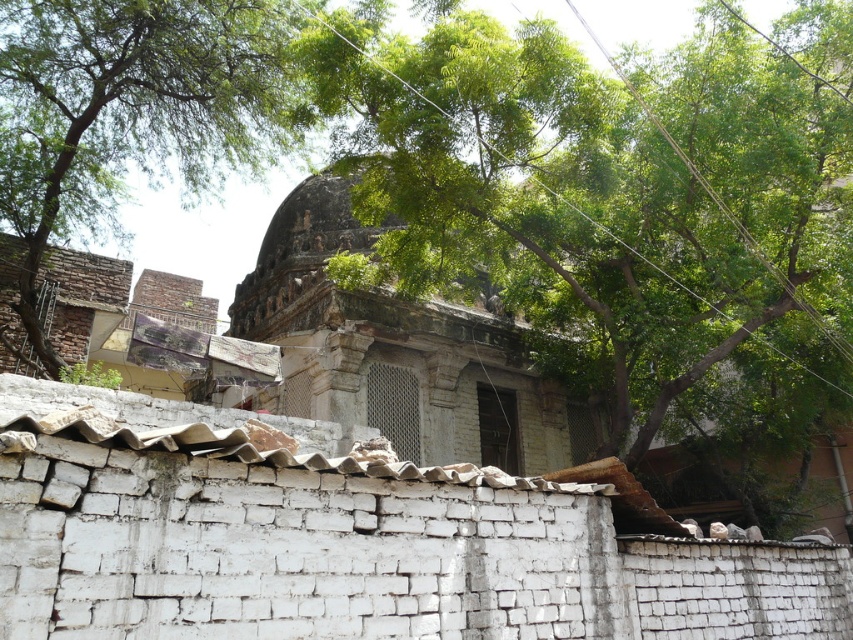
Question: Does green leafy tree at upper center have a lesser width compared to green leafy tree at upper left?

Choices:
 (A) no
 (B) yes

Answer: (A)

Question: Among these objects, which one is farthest from the camera?

Choices:
 (A) green leafy tree at upper left
 (B) green leafy tree at upper center

Answer: (A)

Question: Which point appears farthest from the camera in this image?

Choices:
 (A) (590, 225)
 (B) (38, 342)

Answer: (A)

Question: Does green leafy tree at upper center have a larger size compared to green leafy tree at upper left?

Choices:
 (A) yes
 (B) no

Answer: (A)

Question: Is green leafy tree at upper center wider than green leafy tree at upper left?

Choices:
 (A) yes
 (B) no

Answer: (A)